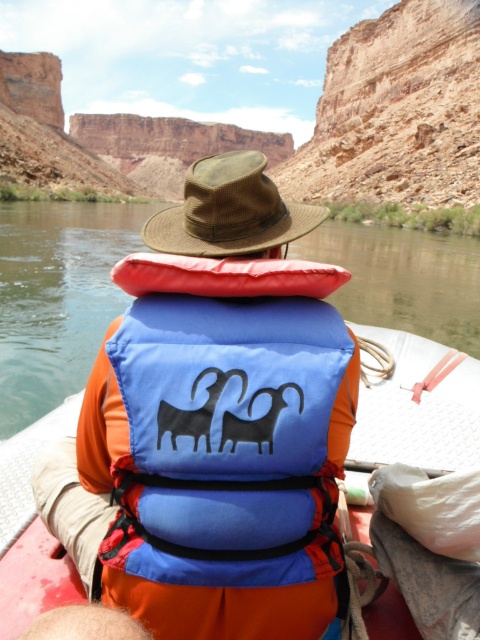
You are a safety inspector evaluating the gear of a whitewater rafting participant. You notice the blue fabric life jacket at center and the brown woven hat at center. Which item is smaller in size?

The blue fabric life jacket at center is smaller in size compared to the brown woven hat at center.

Consider the image. You are a safety inspector checking the raft setup for a whitewater rafting trip. You notice the blue fabric life jacket at center and the green rubber raft at center. According to safety protocols, the life jacket must be worn over the raft. Is the current arrangement compliant?

The blue fabric life jacket at center is in front of green rubber raft at center, meaning it is worn over the raft. This arrangement is compliant with safety protocols.